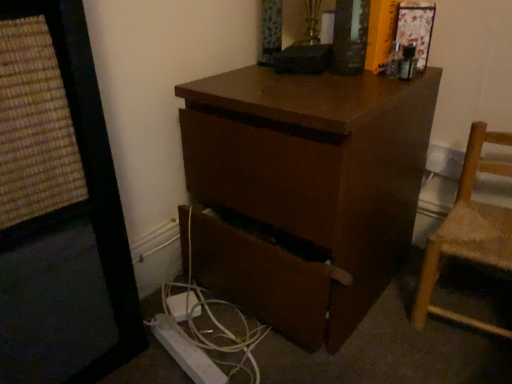
Question: Can you confirm if brown matte desk at center is wider than light brown woven wood chair at right?

Choices:
 (A) yes
 (B) no

Answer: (A)

Question: Is brown matte desk at center shorter than light brown woven wood chair at right?

Choices:
 (A) no
 (B) yes

Answer: (A)

Question: From the image's perspective, is brown matte desk at center on light brown woven wood chair at right?

Choices:
 (A) yes
 (B) no

Answer: (A)

Question: Is brown matte desk at center aimed at light brown woven wood chair at right?

Choices:
 (A) no
 (B) yes

Answer: (A)

Question: Is brown matte desk at center positioned with its back to light brown woven wood chair at right?

Choices:
 (A) yes
 (B) no

Answer: (B)

Question: Is brown matte desk at center at the left side of light brown woven wood chair at right?

Choices:
 (A) yes
 (B) no

Answer: (A)

Question: Can you confirm if white plastic cable at lower center is wider than light brown woven wood chair at right?

Choices:
 (A) no
 (B) yes

Answer: (B)

Question: From a real-world perspective, is white plastic cable at lower center on light brown woven wood chair at right?

Choices:
 (A) no
 (B) yes

Answer: (A)

Question: Can you confirm if white plastic cable at lower center is bigger than light brown woven wood chair at right?

Choices:
 (A) yes
 (B) no

Answer: (B)

Question: Can you confirm if white plastic cable at lower center is shorter than light brown woven wood chair at right?

Choices:
 (A) no
 (B) yes

Answer: (B)

Question: Could you tell me if white plastic cable at lower center is facing light brown woven wood chair at right?

Choices:
 (A) yes
 (B) no

Answer: (B)

Question: Can you confirm if white plastic cable at lower center is positioned to the left of light brown woven wood chair at right?

Choices:
 (A) yes
 (B) no

Answer: (A)

Question: Considering the relative sizes of light brown woven wood chair at right and white plastic cable at lower center in the image provided, is light brown woven wood chair at right wider than white plastic cable at lower center?

Choices:
 (A) no
 (B) yes

Answer: (A)